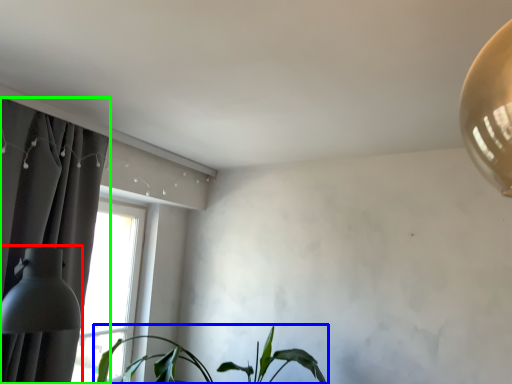
Question: Based on their relative distances, which object is farther from table lamp (highlighted by a red box)? Choose from houseplant (highlighted by a blue box) and curtain (highlighted by a green box).

Choices:
 (A) houseplant
 (B) curtain

Answer: (A)